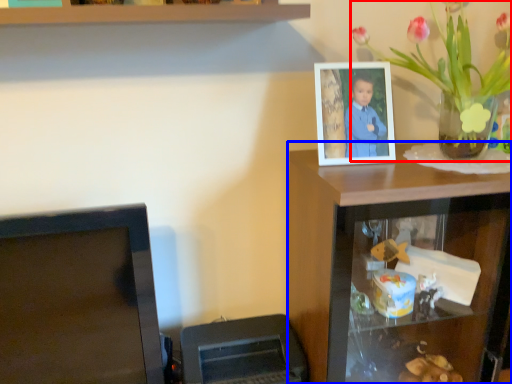
Question: Among these objects, which one is nearest to the camera, houseplant (highlighted by a red box) or computer desk (highlighted by a blue box)?

Choices:
 (A) houseplant
 (B) computer desk

Answer: (A)